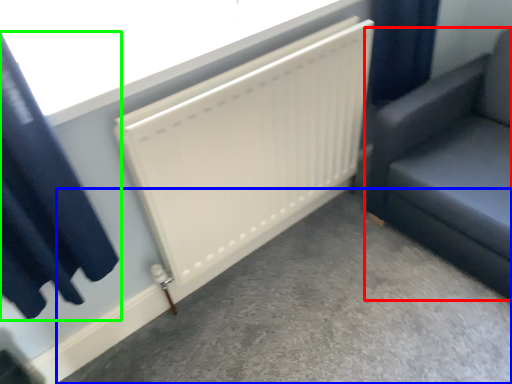
Question: Considering the real-world distances, which object is closest to furniture (highlighted by a red box)? concrete (highlighted by a blue box) or curtain (highlighted by a green box).

Choices:
 (A) concrete
 (B) curtain

Answer: (A)